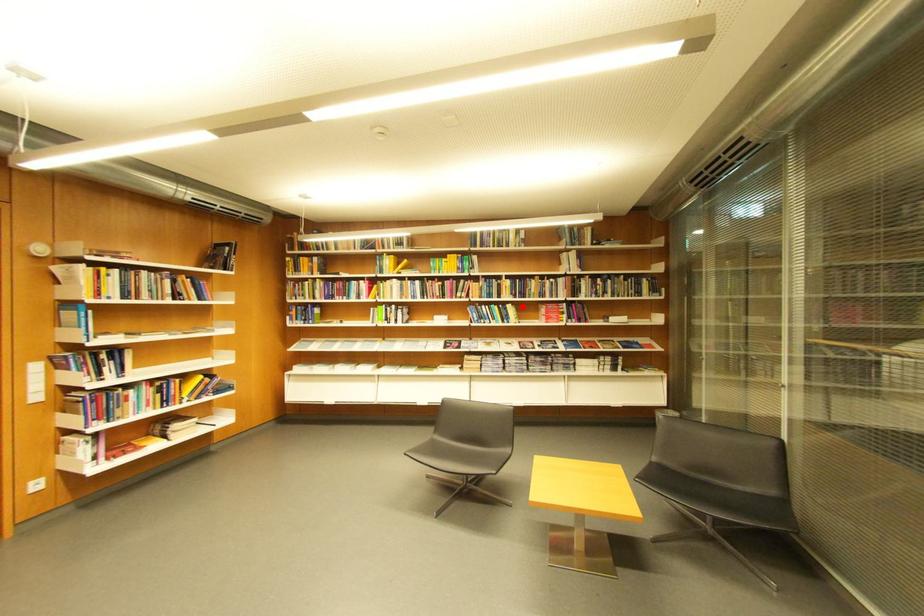
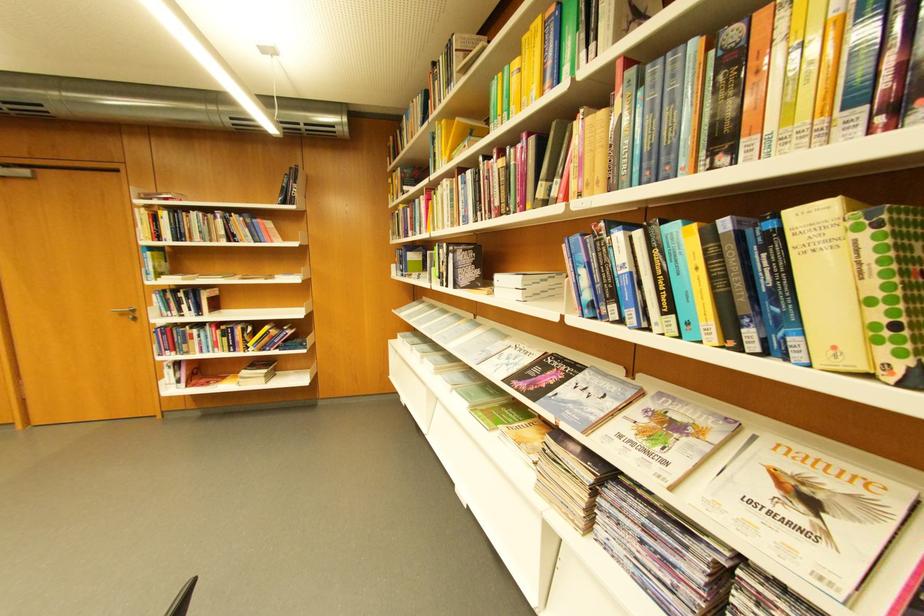
Where in the second image is the point corresponding to the highlighted location from the first image?

(861, 209)